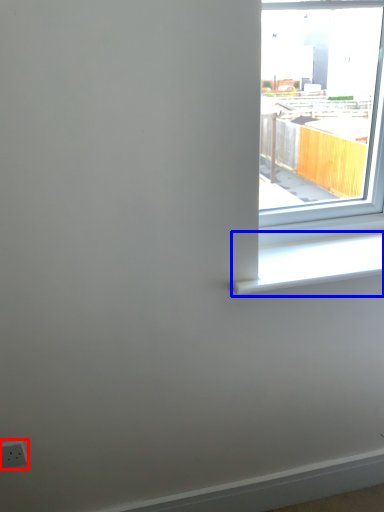
Question: Which of the following is the farthest to the observer, electric outlet (highlighted by a red box) or window sill (highlighted by a blue box)?

Choices:
 (A) electric outlet
 (B) window sill

Answer: (A)